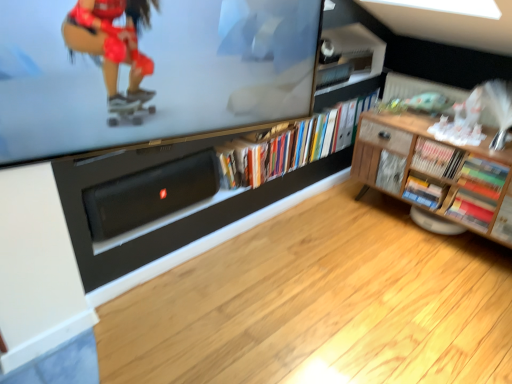
This screenshot has height=384, width=512. I want to click on vacant area that is in front of wooden cabinet at right, so click(x=434, y=297).